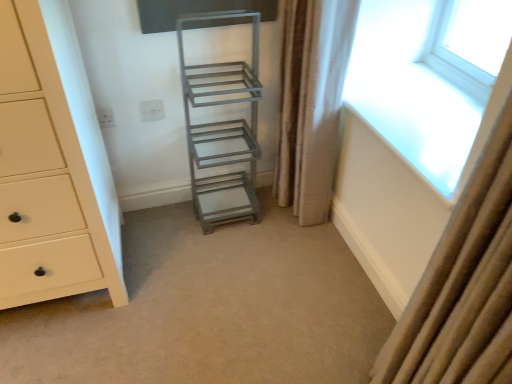
You are a GUI agent. You are given a task and a screenshot of the screen. Output one action in this format:
    pyautogui.click(x=<x>, y=<y>)
    Task: Click on the free point in front of beige textured curtain at right, marked as the second curtain in a front-to-back arrangement
    The width and height of the screenshot is (512, 384).
    Given the screenshot: What is the action you would take?
    pyautogui.click(x=298, y=246)